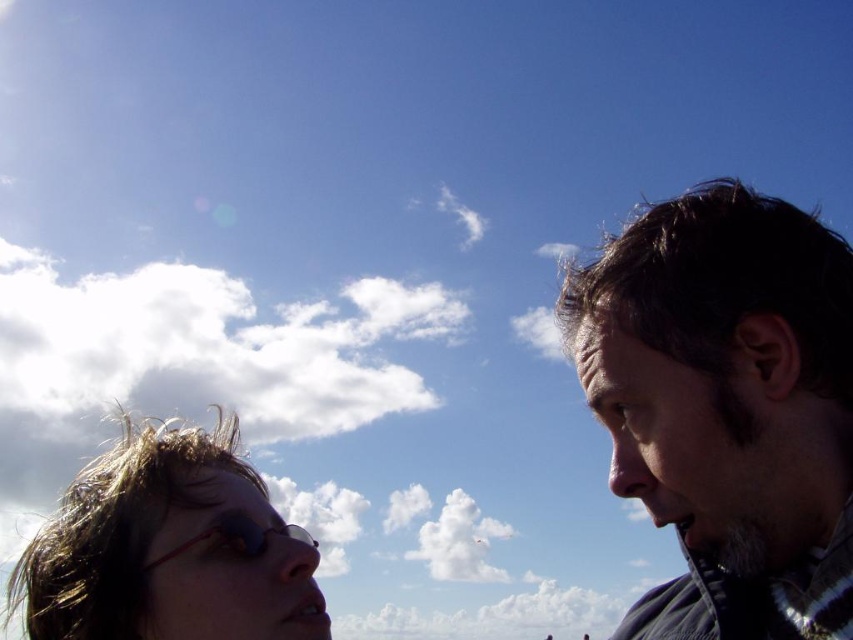
You are a photographer trying to capture a candid shot of both individuals in the scene. Since the dark brown hair at right and the sunglasses at lower left are in the frame, can you tell me which one is located more to the right side of the image?

The dark brown hair at right is positioned on the right side of sunglasses at lower left, so the dark brown hair at right is more to the right in the image.

You are standing at the point with coordinates point [804,305] and want to walk towards the point with coordinates point [225,436]. Given that both points are in the image, will you move forward or backward to reach your destination?

Since point [804,305] is in front of point [225,436], moving forward from point [804,305] towards point [225,436] would mean moving away from the destination. Therefore, you should move backward to reach point [225,436].

You are standing in the scene and want to reach a specific point marked at coordinates point (672,221). Considering your height is 5.5 feet, will you be able to see the top of the point from your current position?

The distance of point (672,221) from viewer is 37.60 feet. Since the point is at a coordinate, it is likely a location on the ground or within your line of sight. As there are no obstacles mentioned in the scene description, you should be able to see the top of the point from your current position.